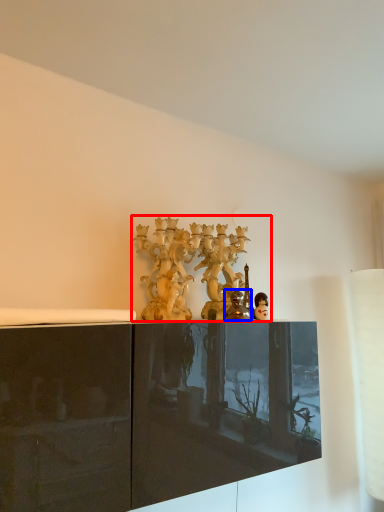
Question: Which object appears closest to the camera in this image, collection (highlighted by a red box) or figurine (highlighted by a blue box)?

Choices:
 (A) collection
 (B) figurine

Answer: (B)